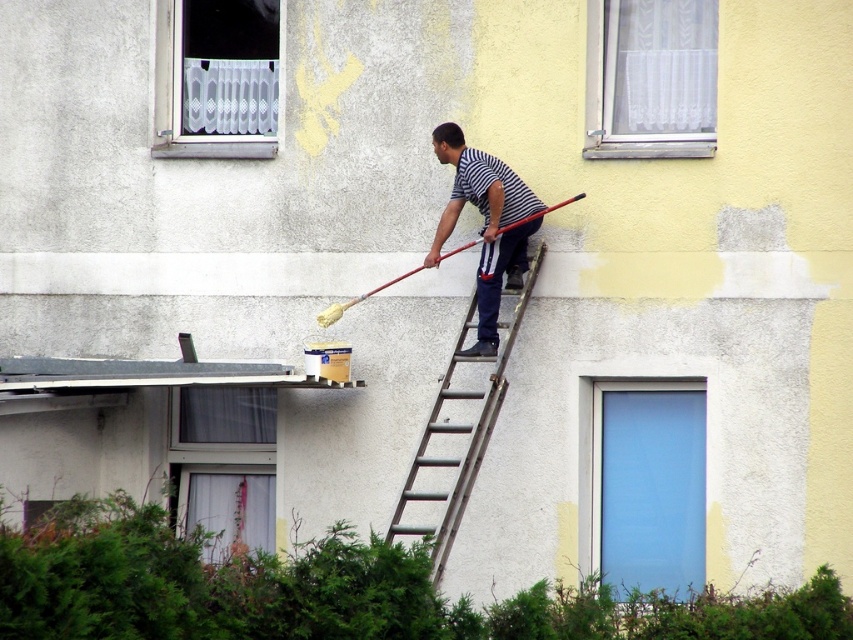
You are a painter who wants to reach the window on the left. The metallic silver ladder at center is blocking your path to the striped fabric shirt at center. Do you need to move the ladder first?

The metallic silver ladder at center is in front of striped fabric shirt at center, so you need to move the ladder first to access the striped fabric shirt at center.

You are a painter who needs to access the transparent glass door at center and the white sheer curtain at upper center. Based on the scene, which object is located to the right of the other?

The transparent glass door at center is positioned on the left side of white sheer curtain at upper center, so the white sheer curtain at upper center is to the right of the transparent glass door at center.